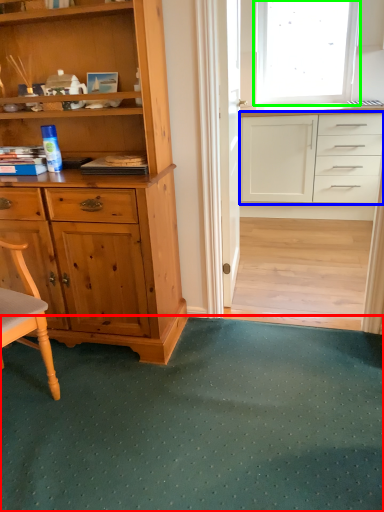
Question: Which object is the closest to the doormat (highlighted by a red box)? Choose among these: cabinetry (highlighted by a blue box) or window (highlighted by a green box).

Choices:
 (A) cabinetry
 (B) window

Answer: (A)